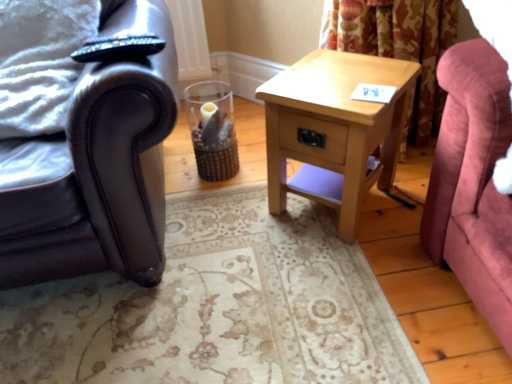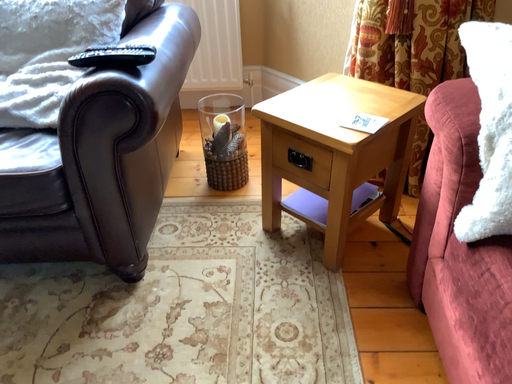
Question: How did the camera likely rotate when shooting the video?

Choices:
 (A) rotated left
 (B) rotated right

Answer: (A)